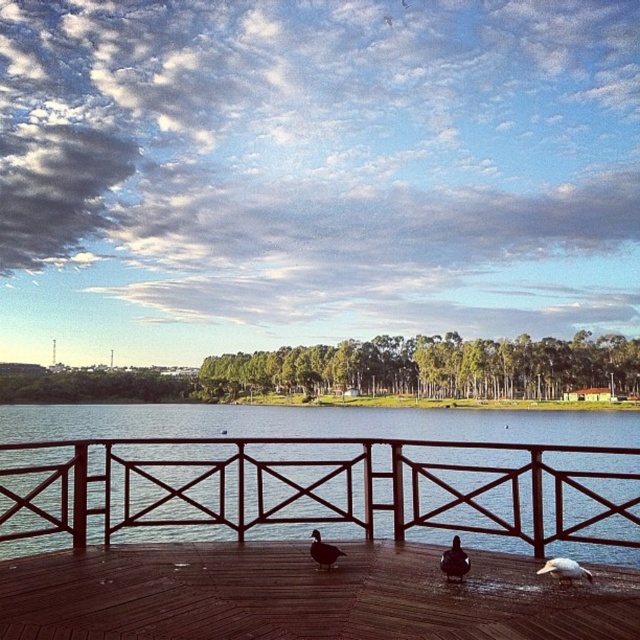
Question: Is brown wooden rail at center bigger than dark brown feathers at center?

Choices:
 (A) yes
 (B) no

Answer: (A)

Question: Is brown wooden rail at center closer to camera compared to dark brown duck at center?

Choices:
 (A) yes
 (B) no

Answer: (B)

Question: Is white feathered bird at lower right wider than dark brown feathers at center?

Choices:
 (A) yes
 (B) no

Answer: (A)

Question: Which point is farther to the camera?

Choices:
 (A) brown wooden rail at center
 (B) brown wooden deck at center
 (C) dark brown feathers at center
 (D) dark brown duck at center

Answer: (A)

Question: Which of the following is the closest to the observer?

Choices:
 (A) (541, 552)
 (B) (452, 536)
 (C) (92, 628)
 (D) (328, 557)

Answer: (C)

Question: Among these objects, which one is nearest to the camera?

Choices:
 (A) dark brown feathers at center
 (B) dark brown duck at center
 (C) brown wooden deck at center
 (D) brown wooden rail at center

Answer: (C)